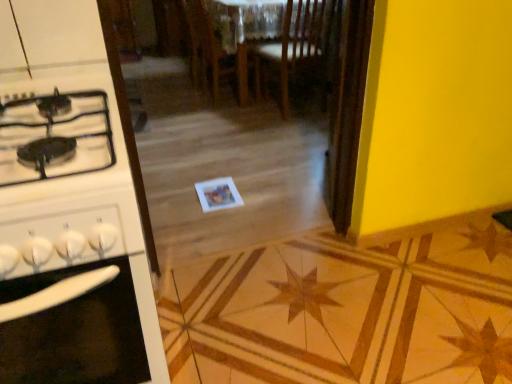
Question: Visually, is wooden screen door at center positioned to the left or to the right of white glossy stove at left?

Choices:
 (A) left
 (B) right

Answer: (B)

Question: Considering the positions of point tap(334, 82) and point tap(110, 79), is point tap(334, 82) closer or farther from the camera than point tap(110, 79)?

Choices:
 (A) farther
 (B) closer

Answer: (A)

Question: Which object is positioned closest to the wooden chair at center, which is counted as the 1th chair, starting from the left?

Choices:
 (A) wooden chair at center, which is the second chair from left to right
 (B) white glossy stove at left
 (C) wooden screen door at center

Answer: (A)

Question: Which object is the closest to the white glossy stove at left?

Choices:
 (A) wooden screen door at center
 (B) wooden chair at center, acting as the second chair starting from the right
 (C) wooden chair at center, which is the second chair from left to right

Answer: (A)